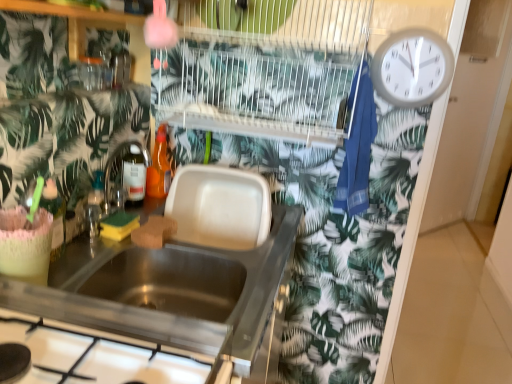
Question: Is metallic stainless steel sink at center aimed at stainless steel gas stove at lower left?

Choices:
 (A) no
 (B) yes

Answer: (A)

Question: From a real-world perspective, is metallic stainless steel sink at center over stainless steel gas stove at lower left?

Choices:
 (A) no
 (B) yes

Answer: (A)

Question: Is metallic stainless steel sink at center in contact with stainless steel gas stove at lower left?

Choices:
 (A) no
 (B) yes

Answer: (A)

Question: Is metallic stainless steel sink at center turned away from stainless steel gas stove at lower left?

Choices:
 (A) no
 (B) yes

Answer: (A)

Question: Is metallic stainless steel sink at center taller than stainless steel gas stove at lower left?

Choices:
 (A) yes
 (B) no

Answer: (A)

Question: Considering the relative sizes of metallic stainless steel sink at center and stainless steel gas stove at lower left in the image provided, is metallic stainless steel sink at center smaller than stainless steel gas stove at lower left?

Choices:
 (A) no
 (B) yes

Answer: (A)

Question: From a real-world perspective, does stainless steel gas stove at lower left stand above white plastic wall clock at upper right?

Choices:
 (A) yes
 (B) no

Answer: (B)

Question: From a real-world perspective, is stainless steel gas stove at lower left under white plastic wall clock at upper right?

Choices:
 (A) yes
 (B) no

Answer: (A)

Question: From the image's perspective, is stainless steel gas stove at lower left above white plastic wall clock at upper right?

Choices:
 (A) yes
 (B) no

Answer: (B)

Question: Is stainless steel gas stove at lower left wider than white plastic wall clock at upper right?

Choices:
 (A) yes
 (B) no

Answer: (A)

Question: Is stainless steel gas stove at lower left oriented away from white plastic wall clock at upper right?

Choices:
 (A) no
 (B) yes

Answer: (A)

Question: Is the position of stainless steel gas stove at lower left more distant than that of white plastic wall clock at upper right?

Choices:
 (A) no
 (B) yes

Answer: (A)

Question: Can you confirm if white plastic wall clock at upper right is shorter than translucent orange bottle at sink, which is the second bottle from left to right?

Choices:
 (A) no
 (B) yes

Answer: (A)